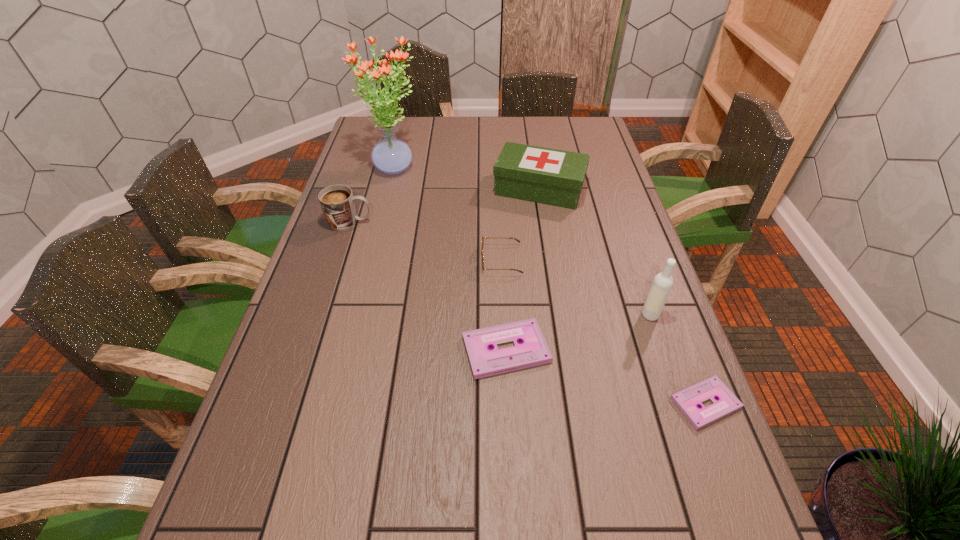
I want to click on flower arrangement that is at the left edge, so click(x=391, y=155).

What are the coordinates of `mug located in the left edge section of the desktop` in the screenshot? It's located at (337, 201).

Identify the location of videotape that is at the right edge. (687, 400).

Locate an element on the screen. This screenshot has width=960, height=540. the first-aid kit present at the right edge is located at coordinates (549, 176).

The height and width of the screenshot is (540, 960). I want to click on vodka that is at the right edge, so click(662, 284).

In order to click on vacant space at the far edge in this screenshot , I will do `click(514, 121)`.

At what (x,y) coordinates should I click in order to perform the action: click on vacant space at the left edge. Please return your answer as a coordinate pair (x, y). Looking at the image, I should click on (360, 177).

This screenshot has height=540, width=960. Find the location of `free space at the right edge`. free space at the right edge is located at coordinates (606, 253).

You are a GUI agent. You are given a task and a screenshot of the screen. Output one action in this format:
    pyautogui.click(x=<x>, y=<y>)
    Task: Click on the free space at the far right corner of the desktop
    This screenshot has width=960, height=540.
    Given the screenshot: What is the action you would take?
    pyautogui.click(x=577, y=127)

This screenshot has height=540, width=960. Identify the location of blank region between the vodka and the sunglasses. (575, 287).